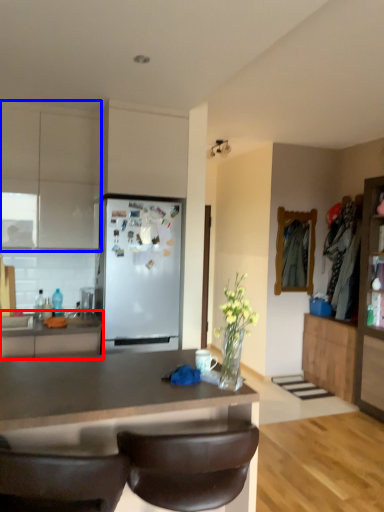
Question: Which of the following is the closest to the observer, cabinetry (highlighted by a red box) or cabinetry (highlighted by a blue box)?

Choices:
 (A) cabinetry
 (B) cabinetry

Answer: (A)